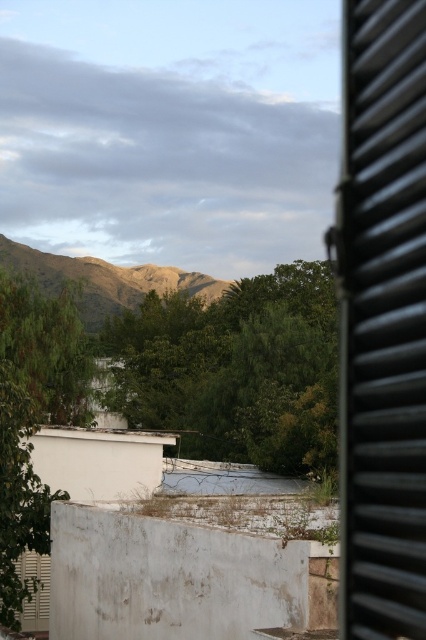
You are standing in a room with a window. There is a point marked at coordinates (x=382, y=320) on the window. Based on the scene description, what object is located at that point?

The point at coordinates (x=382, y=320) marks the location of the black corrugated metal window at right.

You are standing inside a room and looking through the window. You see the black corrugated metal window at right and the green leafy tree at center. Which object is positioned to the right side of the other?

The black corrugated metal window at right is positioned to the right of the green leafy tree at center.

You are an interior designer assessing the view from a room. You notice the black corrugated metal window at right and the green leafy tree at center. Which object takes up more space in the window frame?

The green leafy tree at center takes up more space in the window frame because it is larger than the black corrugated metal window at right.